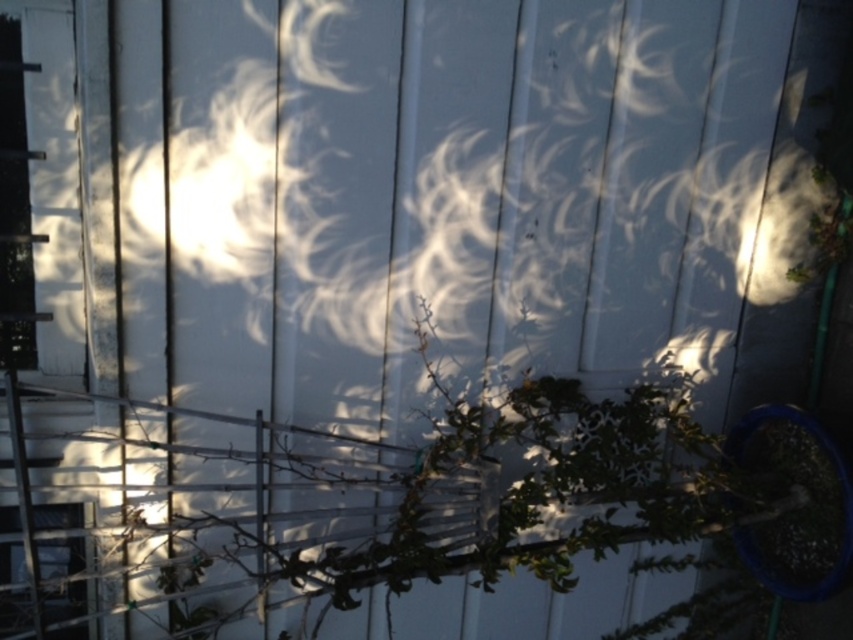
Looking at this image, does green leafy plant at center have a greater width compared to transparent glass window at lower left?

Indeed, green leafy plant at center has a greater width compared to transparent glass window at lower left.

Locate an element on the screen. green leafy plant at center is located at coordinates (502, 493).